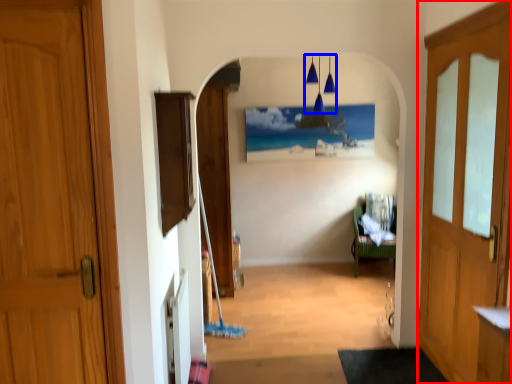
Question: Which object appears farthest to the camera in this image, door (highlighted by a red box) or lamp (highlighted by a blue box)?

Choices:
 (A) door
 (B) lamp

Answer: (B)